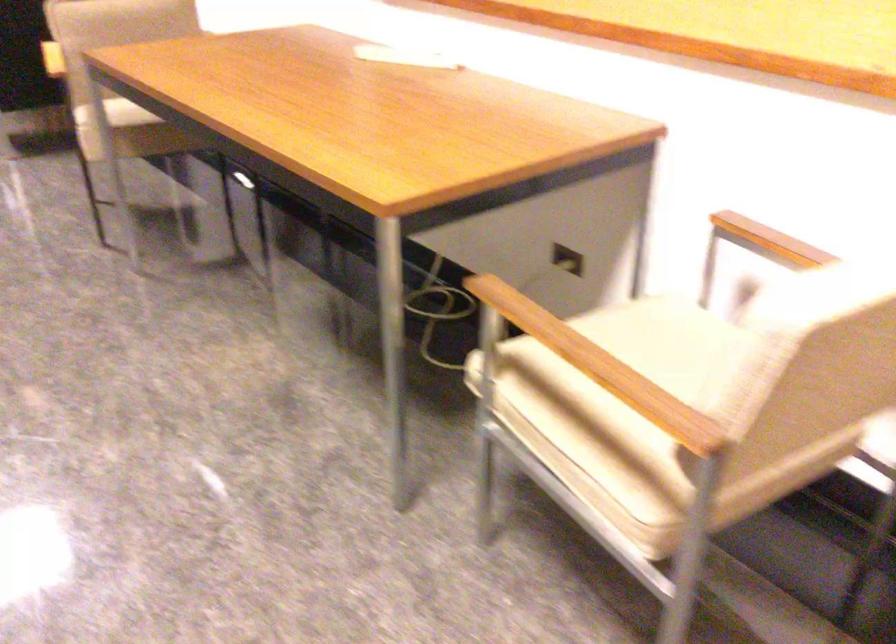
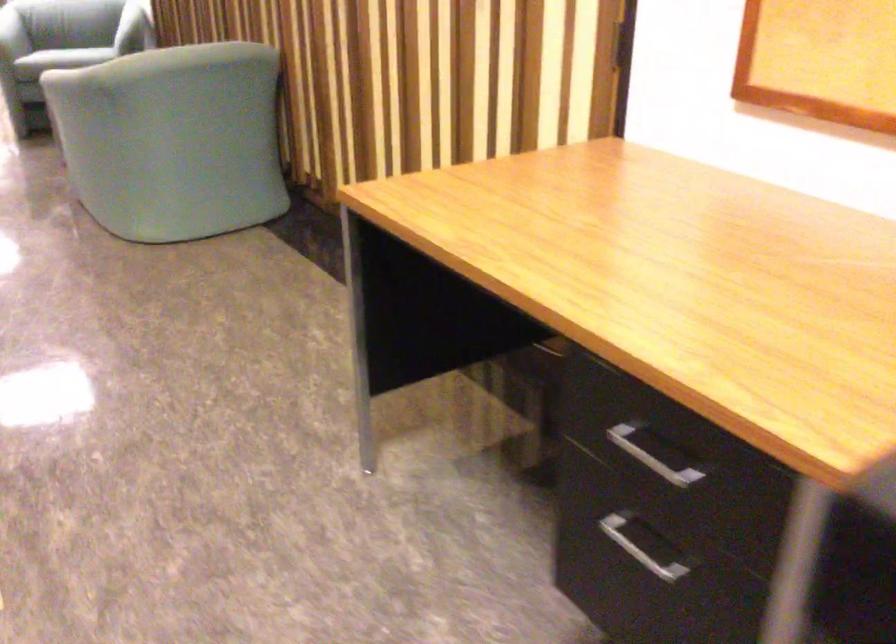
The images are taken continuously from a first-person perspective. In which direction are you moving?

The cameraman walked toward left, forward.